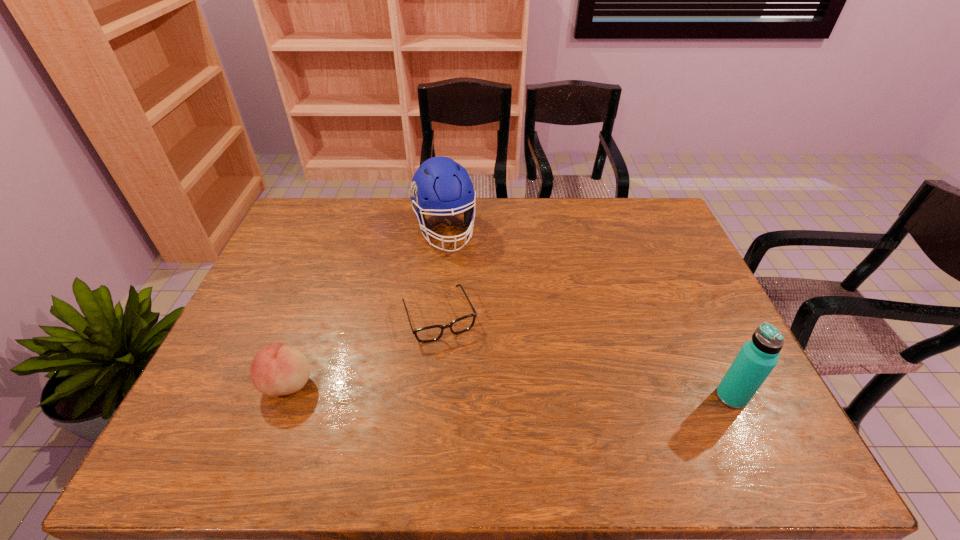
The image size is (960, 540). What are the coordinates of `free space located 0.170m on the front-facing side of the farthest object` in the screenshot? It's located at (465, 291).

Locate an element on the screen. Image resolution: width=960 pixels, height=540 pixels. blank space located 0.070m on the front-facing side of the shortest object is located at coordinates (460, 363).

I want to click on vacant area located on the front-facing side of the shortest object, so click(482, 417).

Identify the location of vacant space located on the front-facing side of the shortest object. (471, 393).

I want to click on object positioned at the far edge, so click(440, 185).

Locate an element on the screen. The height and width of the screenshot is (540, 960). peach present at the near edge is located at coordinates (276, 370).

Where is `water bottle positioned at the near edge`? water bottle positioned at the near edge is located at coordinates (757, 358).

Where is `object that is positioned at the left edge`? object that is positioned at the left edge is located at coordinates (276, 370).

Where is `object at the right edge`? object at the right edge is located at coordinates (757, 358).

The image size is (960, 540). Find the location of `object at the near left corner`. object at the near left corner is located at coordinates [x=276, y=370].